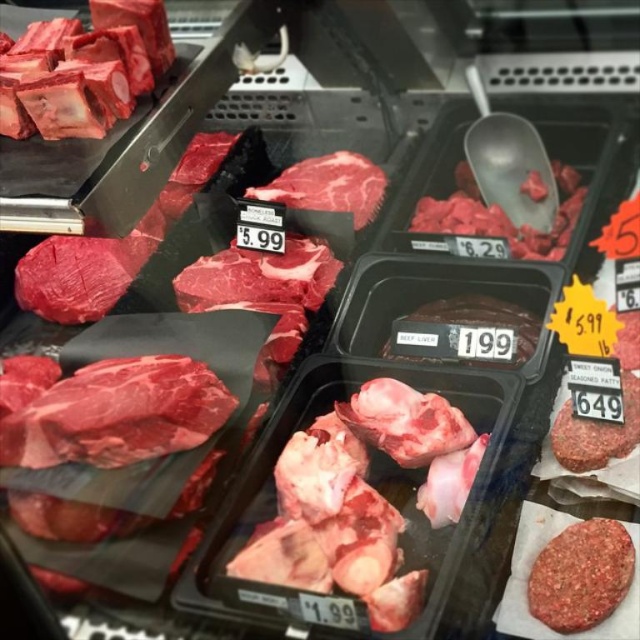
Does pinkish-red ground meat patty at lower right appear on the right side of matte red meat at center?

Indeed, pinkish-red ground meat patty at lower right is positioned on the right side of matte red meat at center.

Is pinkish-red ground meat patty at lower right taller than matte red meat at center?

No, pinkish-red ground meat patty at lower right is not taller than matte red meat at center.

The image size is (640, 640). I want to click on pinkish-red ground meat patty at lower right, so click(580, 576).

Is dark red bone-in meat at upper left shorter than pinkish-red ground meat patty at lower right?

In fact, dark red bone-in meat at upper left may be taller than pinkish-red ground meat patty at lower right.

Does point (8, 113) come behind point (621, 554)?

Yes.

Does point (1, 90) lie behind point (589, 573)?

Yes, it is.

Locate an element on the screen. Image resolution: width=640 pixels, height=640 pixels. dark red bone-in meat at upper left is located at coordinates (83, 70).

Does dark brown textured beef at center appear on the left side of matte red meat at center?

No, dark brown textured beef at center is not to the left of matte red meat at center.

Is dark brown textured beef at center thinner than matte red meat at center?

Indeed, dark brown textured beef at center has a lesser width compared to matte red meat at center.

Locate an element on the screen. dark brown textured beef at center is located at coordinates [x=467, y=332].